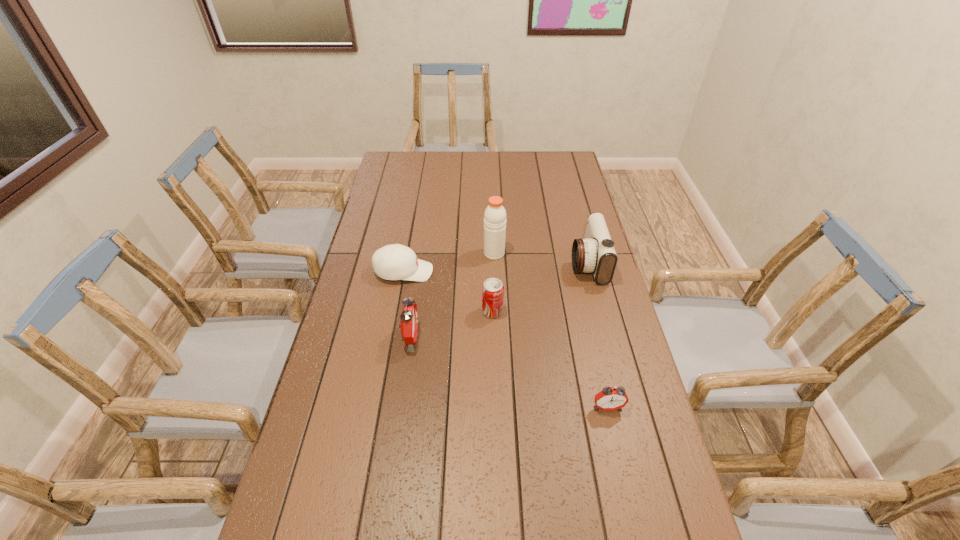
Find the location of a particular element. This screenshot has height=540, width=960. the fifth farthest object is located at coordinates (409, 321).

I want to click on the farther alarm clock, so click(x=409, y=321).

Identify the location of the nearest object. This screenshot has width=960, height=540. (610, 398).

This screenshot has width=960, height=540. I want to click on the nearer alarm clock, so click(610, 398).

This screenshot has height=540, width=960. I want to click on baseball cap, so click(x=392, y=262).

I want to click on camcorder, so click(x=596, y=254).

What are the coordinates of `shaker` in the screenshot? It's located at (495, 216).

Where is `the fourth farthest object`? The height and width of the screenshot is (540, 960). the fourth farthest object is located at coordinates (492, 290).

Find the location of a particular element. This screenshot has height=540, width=960. vacant space situated 0.330m on the clock face of the second nearest object is located at coordinates (529, 337).

The height and width of the screenshot is (540, 960). I want to click on vacant region located on the clock face of the nearer alarm clock, so click(627, 493).